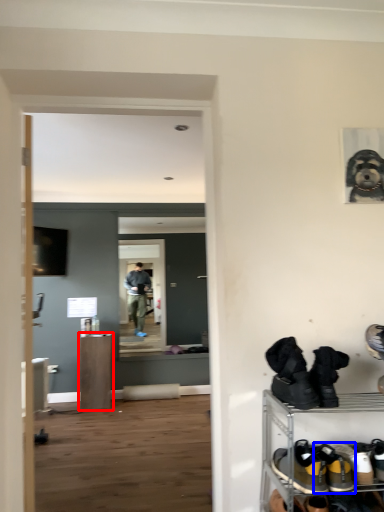
Question: Which object appears closest to the camera in this image, furniture (highlighted by a red box) or footwear (highlighted by a blue box)?

Choices:
 (A) furniture
 (B) footwear

Answer: (B)